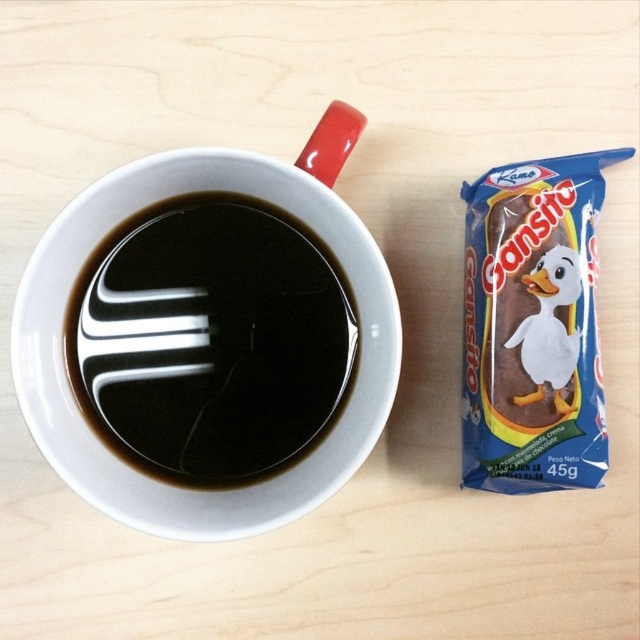
You are setting up a small table for a quick breakfast. You have a black glossy coffee cup at upper left and a brown chocolate wafer at right. If you want to place them side by side on the table, which item should you place first to ensure they fit properly?

The black glossy coffee cup at upper left is wider than the brown chocolate wafer at right, so you should place the black glossy coffee cup at upper left first to accommodate its larger width.